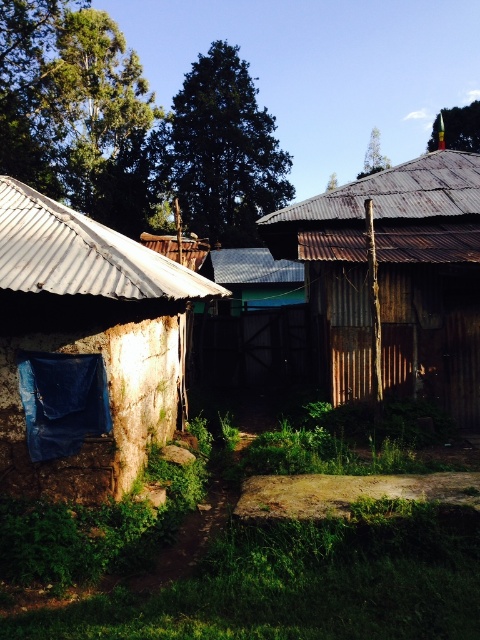
Who is taller, rusty corrugated metal hut at center or rusty corrugated hut at center?

rusty corrugated metal hut at center

Can you confirm if rusty corrugated metal hut at center is positioned to the left of rusty corrugated hut at center?

Correct, you'll find rusty corrugated metal hut at center to the left of rusty corrugated hut at center.

Where is `rusty corrugated metal hut at center`? The image size is (480, 640). rusty corrugated metal hut at center is located at coordinates (88, 339).

Locate an element on the screen. This screenshot has width=480, height=640. rusty corrugated metal hut at center is located at coordinates (88, 339).

Does rusty corrugated metal hut at center have a smaller size compared to white stucco hut at left?

Incorrect, rusty corrugated metal hut at center is not smaller in size than white stucco hut at left.

The height and width of the screenshot is (640, 480). I want to click on rusty corrugated metal hut at center, so click(x=88, y=339).

Can you confirm if rusty corrugated hut at center is positioned above blue tarp at lower left?

Yes.

Between rusty corrugated hut at center and blue tarp at lower left, which one appears on the right side from the viewer's perspective?

Positioned to the right is rusty corrugated hut at center.

What do you see at coordinates (394, 280) in the screenshot?
I see `rusty corrugated hut at center` at bounding box center [394, 280].

The height and width of the screenshot is (640, 480). What are the coordinates of `rusty corrugated hut at center` in the screenshot? It's located at (394, 280).